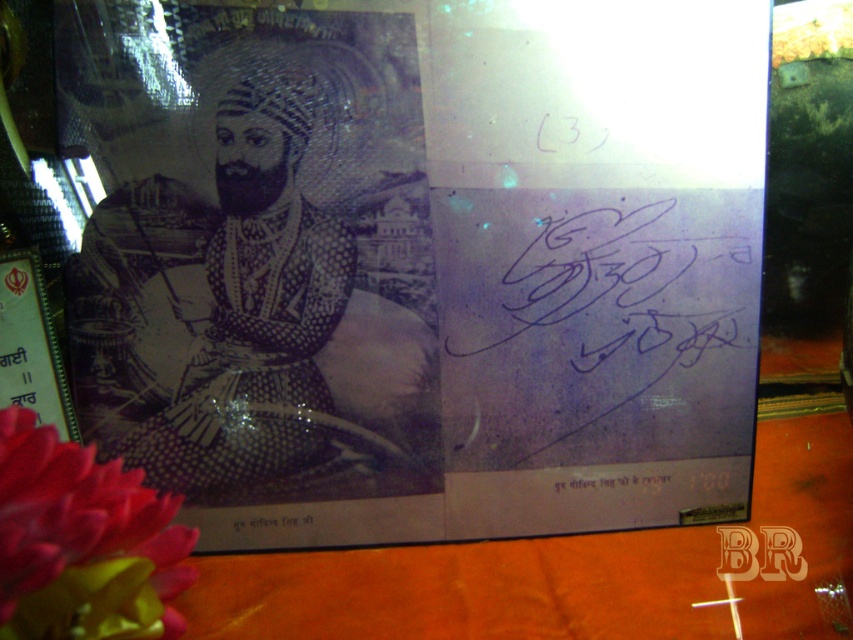
You are an archivist organizing documents and need to place both the black paper portrait at upper left and the black ink signature at lower center into a storage box. The box has a height limit of 10 cm. Can you determine if both items will fit vertically in the box?

The black paper portrait at upper left is larger than the black ink signature at lower center. However, the exact dimensions of both items are not provided, so it is uncertain if they will fit within the 10 cm height limit. Additional measurements are needed to confirm.

You are an art conservator examining the framed photograph. You notice the matte pink petals at lower left and the black ink signature at lower center. Which object is positioned closer to your line of sight?

The matte pink petals at lower left are closer to the viewer than the black ink signature at lower center.